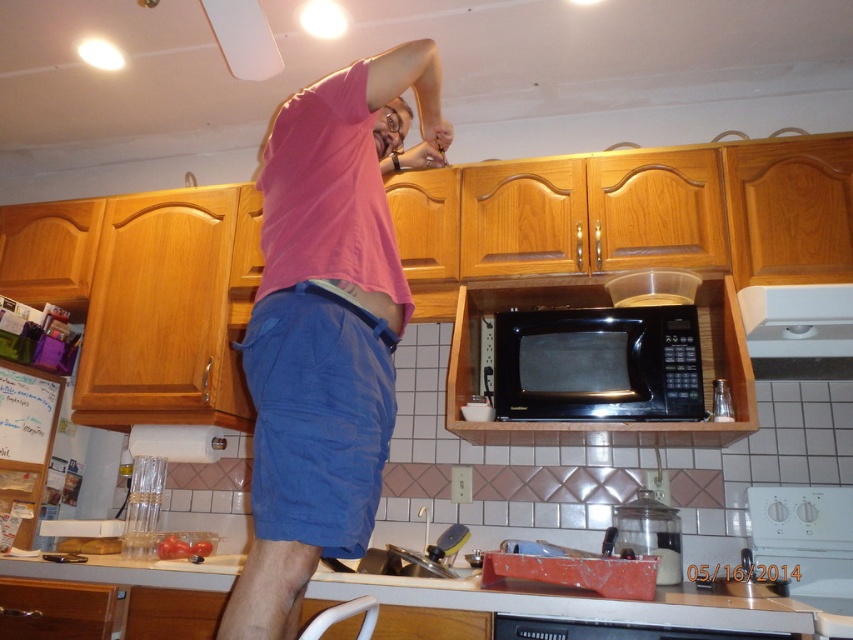
You are a home inspector evaluating the kitchen layout. You notice the pink cotton shirt at upper center. Based on its position, is it hanging or placed on top of an object?

The pink cotton shirt at upper center is hanging because it is located at point coordinates that are above the countertop level, which is typically where upper cabinets are located, and shirts are usually hung there.

You are a kitchen designer planning to place a new appliance between the white glossy countertop at lower center and the white plastic exhaust hood at upper right. Based on their positions, which object should the appliance be placed closer to?

The white glossy countertop at lower center is positioned on the left side of the white plastic exhaust hood at upper right, so the appliance should be placed closer to the white glossy countertop at lower center to maintain alignment with the existing kitchen layout.